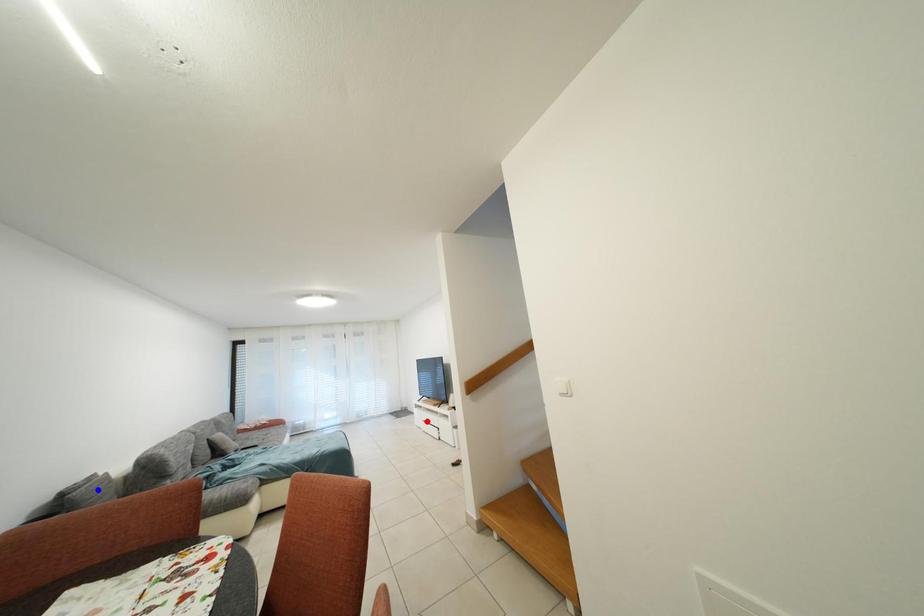
Question: Which of the two points in the image is closer to the camera?

Choices:
 (A) Blue point is closer.
 (B) Red point is closer.

Answer: (A)